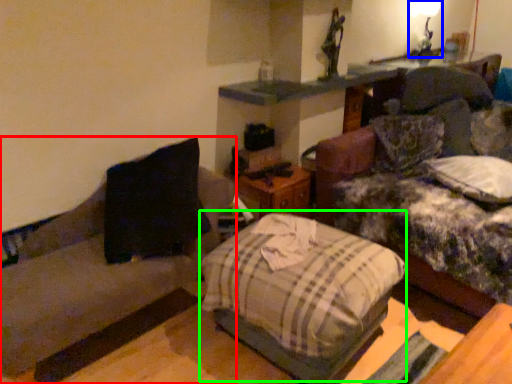
Question: Which object is the closest to the studio couch (highlighted by a red box)? Choose among these: light fixture (highlighted by a blue box) or bed (highlighted by a green box).

Choices:
 (A) light fixture
 (B) bed

Answer: (B)